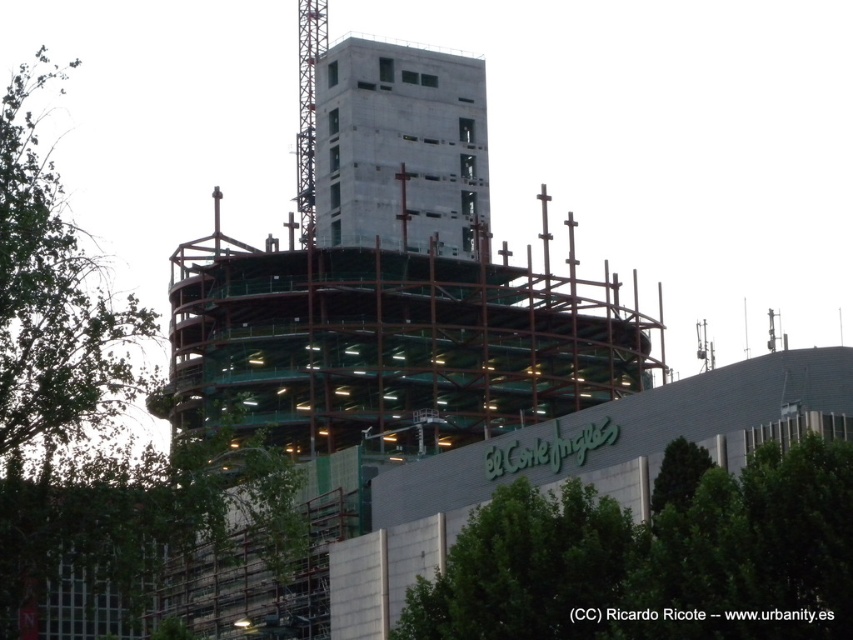
Is green leafy tree at left bigger than green leafy tree at lower right?

Indeed, green leafy tree at left has a larger size compared to green leafy tree at lower right.

Does point (120, 369) lie behind point (474, 534)?

Yes, it is behind point (474, 534).

Is point (65, 243) positioned behind point (720, 612)?

Yes, point (65, 243) is farther from viewer.

Locate an element on the screen. The image size is (853, 640). green leafy tree at left is located at coordinates (94, 412).

How far apart are green leafy tree at left and concrete at center?

The distance of green leafy tree at left from concrete at center is 25.03 meters.

Is green leafy tree at left smaller than concrete at center?

Incorrect, green leafy tree at left is not smaller in size than concrete at center.

Which is behind, point (148, 324) or point (321, 163)?

Point (321, 163)

You are a GUI agent. You are given a task and a screenshot of the screen. Output one action in this format:
    pyautogui.click(x=<x>, y=<y>)
    Task: Click on the green leafy tree at left
    
    Given the screenshot: What is the action you would take?
    pyautogui.click(x=94, y=412)

Describe the element at coordinates (654, 556) in the screenshot. Image resolution: width=853 pixels, height=640 pixels. I see `green leafy tree at lower right` at that location.

Does green leafy tree at lower right have a greater height compared to concrete at center?

In fact, green leafy tree at lower right may be shorter than concrete at center.

Identify the location of green leafy tree at lower right. (654, 556).